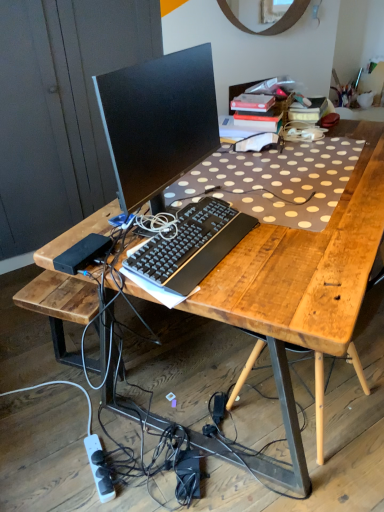
Question: Is black plastic keyboard at center at the left side of matte black monitor at center?

Choices:
 (A) yes
 (B) no

Answer: (B)

Question: Does black plastic keyboard at center turn towards matte black monitor at center?

Choices:
 (A) yes
 (B) no

Answer: (B)

Question: Is black plastic keyboard at center touching matte black monitor at center?

Choices:
 (A) no
 (B) yes

Answer: (A)

Question: Is black plastic keyboard at center located outside matte black monitor at center?

Choices:
 (A) no
 (B) yes

Answer: (B)

Question: Is matte black monitor at center at the back of black plastic keyboard at center?

Choices:
 (A) yes
 (B) no

Answer: (A)

Question: Can you confirm if black plastic keyboard at center is smaller than matte black monitor at center?

Choices:
 (A) yes
 (B) no

Answer: (A)

Question: Considering the relative sizes of white plastic power strip at lower left and matte black monitor at center in the image provided, is white plastic power strip at lower left shorter than matte black monitor at center?

Choices:
 (A) no
 (B) yes

Answer: (B)

Question: Does white plastic power strip at lower left lie in front of matte black monitor at center?

Choices:
 (A) no
 (B) yes

Answer: (A)

Question: Considering the relative positions of white plastic power strip at lower left and matte black monitor at center in the image provided, is white plastic power strip at lower left to the right of matte black monitor at center from the viewer's perspective?

Choices:
 (A) no
 (B) yes

Answer: (A)

Question: Considering the relative sizes of white plastic power strip at lower left and matte black monitor at center in the image provided, is white plastic power strip at lower left smaller than matte black monitor at center?

Choices:
 (A) yes
 (B) no

Answer: (A)

Question: Can you confirm if white plastic power strip at lower left is wider than matte black monitor at center?

Choices:
 (A) no
 (B) yes

Answer: (B)

Question: Is white plastic power strip at lower left at the left side of matte black monitor at center?

Choices:
 (A) no
 (B) yes

Answer: (B)

Question: Is black plastic keyboard at center oriented towards wooden at right?

Choices:
 (A) yes
 (B) no

Answer: (A)